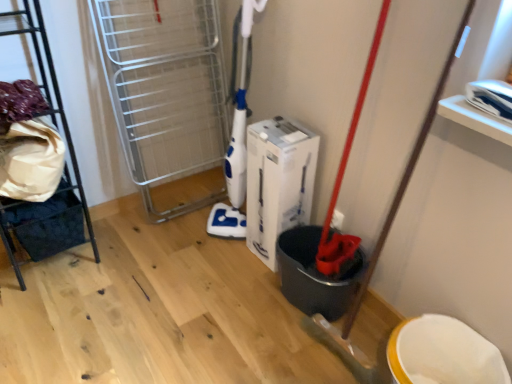
Question: Does metallic black rack at left have a greater height compared to white cardboard box at center?

Choices:
 (A) no
 (B) yes

Answer: (B)

Question: Considering the relative sizes of metallic black rack at left and white cardboard box at center in the image provided, is metallic black rack at left shorter than white cardboard box at center?

Choices:
 (A) yes
 (B) no

Answer: (B)

Question: Considering the relative positions of metallic black rack at left and white cardboard box at center in the image provided, is metallic black rack at left in front of white cardboard box at center?

Choices:
 (A) yes
 (B) no

Answer: (A)

Question: Is metallic black rack at left far away from white cardboard box at center?

Choices:
 (A) no
 (B) yes

Answer: (A)

Question: Does metallic black rack at left have a larger size compared to white cardboard box at center?

Choices:
 (A) yes
 (B) no

Answer: (A)

Question: Considering the relative sizes of metallic black rack at left and white cardboard box at center in the image provided, is metallic black rack at left smaller than white cardboard box at center?

Choices:
 (A) no
 (B) yes

Answer: (A)

Question: Is white cardboard box at center at the right side of metallic black rack at left?

Choices:
 (A) yes
 (B) no

Answer: (A)

Question: Considering the relative positions of white cardboard box at center and metallic black rack at left in the image provided, is white cardboard box at center to the left of metallic black rack at left from the viewer's perspective?

Choices:
 (A) yes
 (B) no

Answer: (B)

Question: From a real-world perspective, is white cardboard box at center located beneath metallic black rack at left?

Choices:
 (A) yes
 (B) no

Answer: (A)

Question: Can we say white cardboard box at center lies outside metallic black rack at left?

Choices:
 (A) yes
 (B) no

Answer: (A)

Question: Is white cardboard box at center wider than metallic black rack at left?

Choices:
 (A) yes
 (B) no

Answer: (B)

Question: From the image's perspective, is white cardboard box at center located above metallic black rack at left?

Choices:
 (A) yes
 (B) no

Answer: (B)

Question: Considering the positions of point (252, 167) and point (26, 23), is point (252, 167) closer or farther from the camera than point (26, 23)?

Choices:
 (A) farther
 (B) closer

Answer: (A)